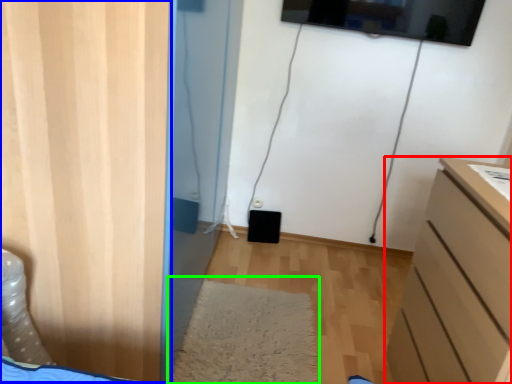
Question: Based on their relative distances, which object is farther from chest of drawers (highlighted by a red box)? Choose from door (highlighted by a blue box) and mat (highlighted by a green box).

Choices:
 (A) door
 (B) mat

Answer: (A)